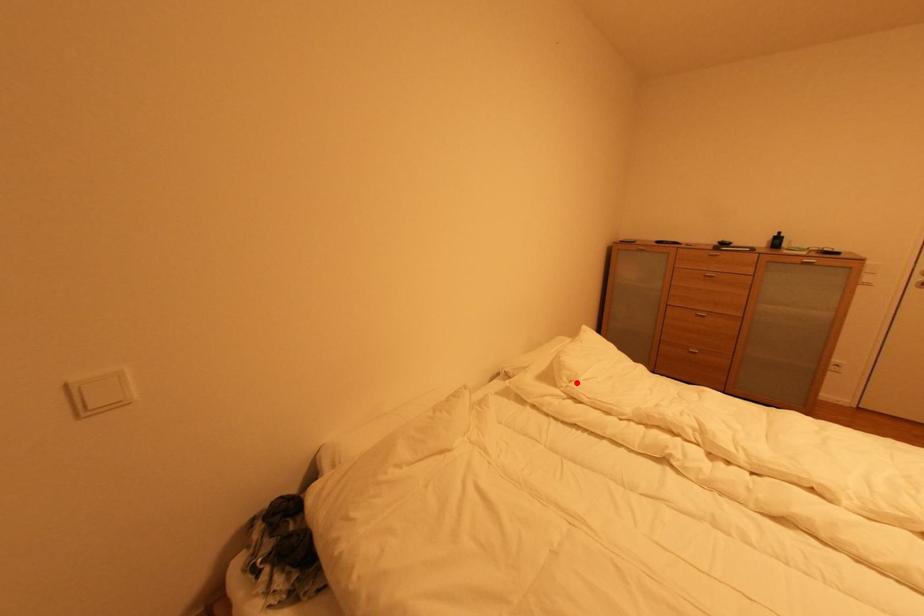
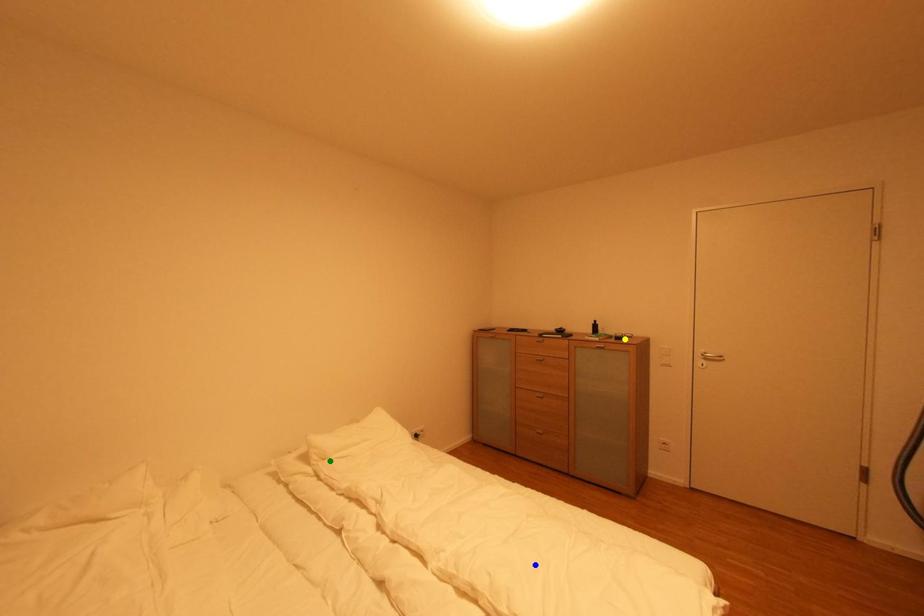
Question: I am providing you with two images of the same scene from different viewpoints. A red point is marked on the first image. You are given multiple points on the second image. Which point in image 2 represents the same 3d spot as the red point in image 1?

Choices:
 (A) blue point
 (B) yellow point
 (C) green point

Answer: (C)